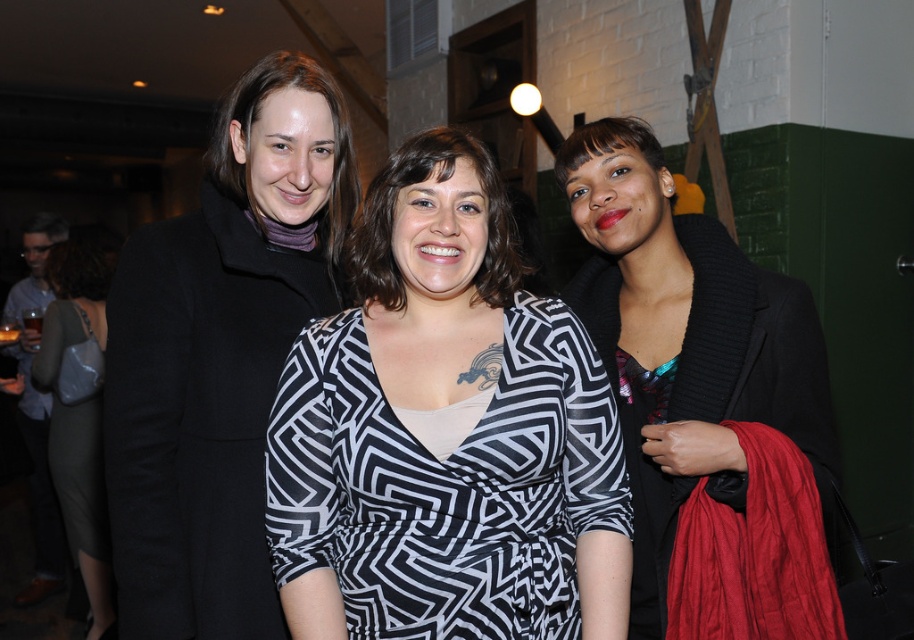
Does black and white patterned dress at center appear under black wool coat at left?

Indeed, black and white patterned dress at center is positioned under black wool coat at left.

Is point (611, 428) less distant than point (210, 557)?

Yes, point (611, 428) is in front of point (210, 557).

Is point (402, 284) farther from viewer compared to point (117, 536)?

Yes, point (402, 284) is behind point (117, 536).

The height and width of the screenshot is (640, 914). I want to click on black and white patterned dress at center, so click(445, 433).

Which is below, matte gray dress at left or matte black jacket at left?

matte gray dress at left is lower down.

Can you confirm if matte gray dress at left is taller than matte black jacket at left?

Incorrect, matte gray dress at left's height is not larger of matte black jacket at left's.

Who is more forward, (59, 308) or (56, 589)?

Point (59, 308) is in front.

Where is `matte gray dress at left`? The width and height of the screenshot is (914, 640). matte gray dress at left is located at coordinates (78, 417).

The height and width of the screenshot is (640, 914). What do you see at coordinates (220, 355) in the screenshot?
I see `black wool coat at left` at bounding box center [220, 355].

Where is `black wool coat at left`? black wool coat at left is located at coordinates (220, 355).